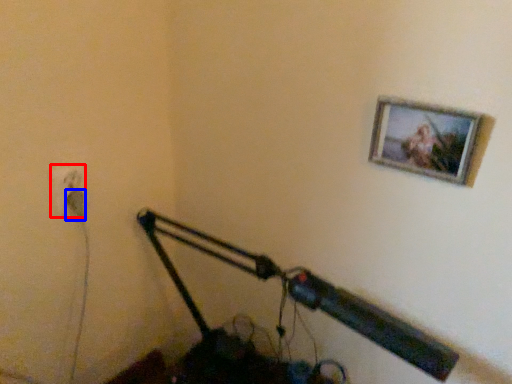
Question: Which of the following is the closest to the observer, electric outlet (highlighted by a red box) or plug (highlighted by a blue box)?

Choices:
 (A) electric outlet
 (B) plug

Answer: (A)